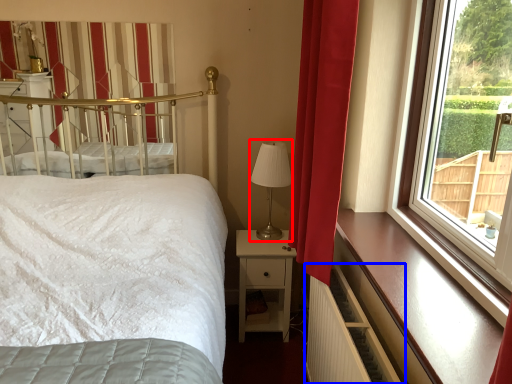
Question: Which object appears closest to the camera in this image, table lamp (highlighted by a red box) or balustrade (highlighted by a blue box)?

Choices:
 (A) table lamp
 (B) balustrade

Answer: (B)